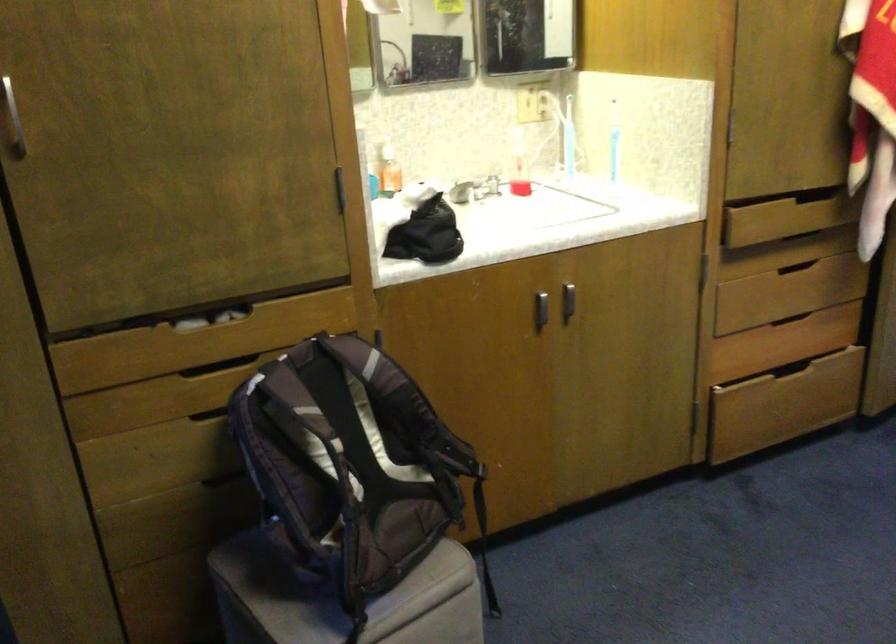
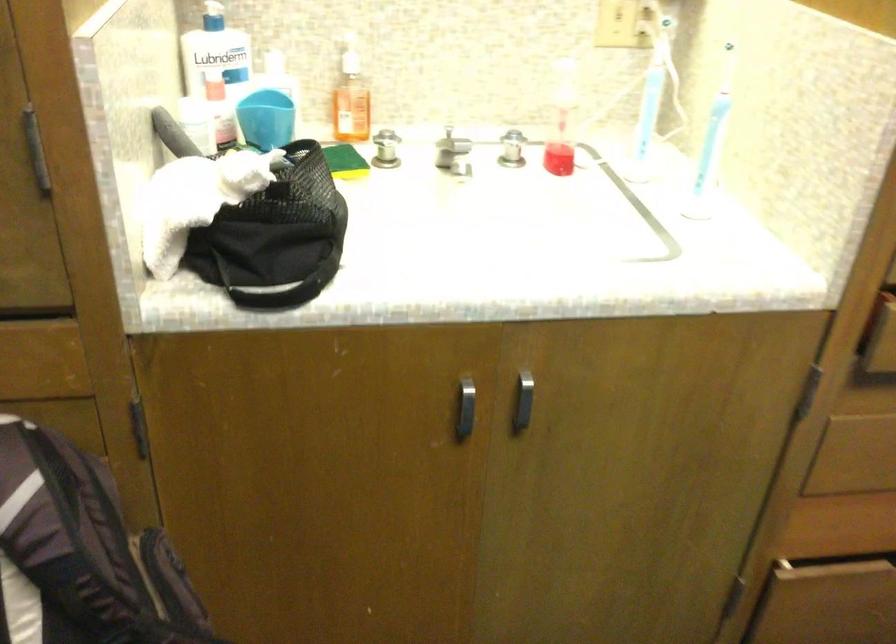
Question: I am providing you with two images of the same scene from different viewpoints. After the viewpoint changes to image2, which objects are now occluded?

Choices:
 (A) black bag strap
 (B) blue plastic cup
 (C) silver cabinet handle
 (D) none of these

Answer: (D)